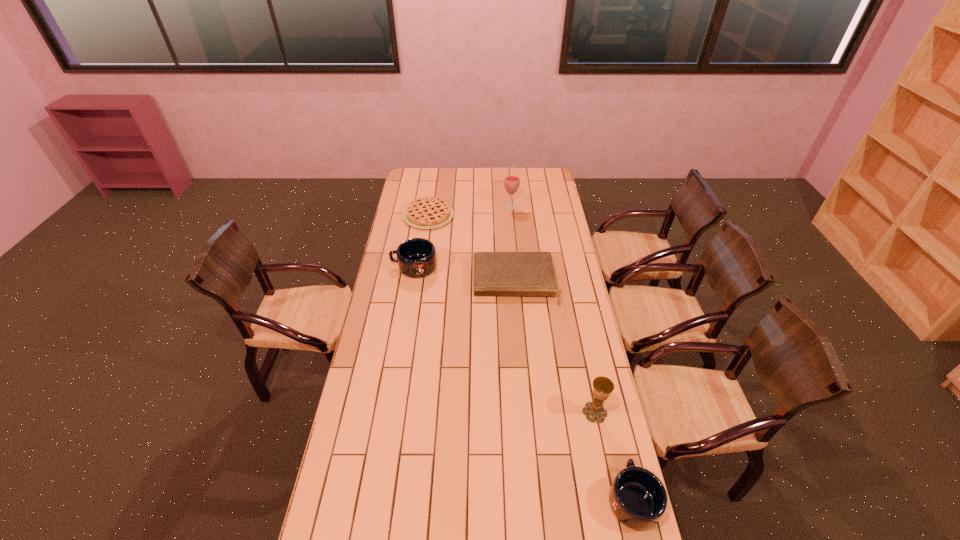
Find the location of a particular element. The height and width of the screenshot is (540, 960). the fourth shortest object is located at coordinates (416, 257).

Identify the location of the taller mug. (416, 257).

At what (x,y) coordinates should I click in order to perform the action: click on the shorter mug. Please return your answer as a coordinate pair (x, y). The image size is (960, 540). Looking at the image, I should click on (637, 497).

Locate an element on the screen. The image size is (960, 540). the right mug is located at coordinates (637, 497).

Locate an element on the screen. wineglass is located at coordinates (511, 181).

I want to click on paperback book, so click(494, 273).

Where is `the shortest object`? the shortest object is located at coordinates (428, 212).

At what (x,y) coordinates should I click in order to perform the action: click on the fifth farthest object. Please return your answer as a coordinate pair (x, y). This screenshot has width=960, height=540. Looking at the image, I should click on (602, 386).

At what (x,y) coordinates should I click in order to perform the action: click on vacant area situated with the handle on the side of the shorter mug. Please return your answer as a coordinate pair (x, y). The image size is (960, 540). Looking at the image, I should click on (614, 423).

At what (x,y) coordinates should I click in order to perform the action: click on vacant space located with the handle on the side of the shorter mug. Please return your answer as a coordinate pair (x, y). Looking at the image, I should click on (614, 423).